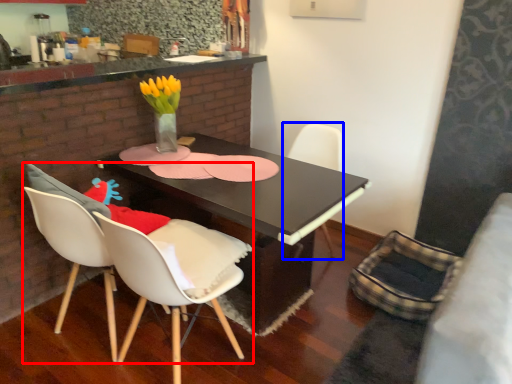
Question: Which object appears farthest to the camera in this image, chair (highlighted by a red box) or chair (highlighted by a blue box)?

Choices:
 (A) chair
 (B) chair

Answer: (B)